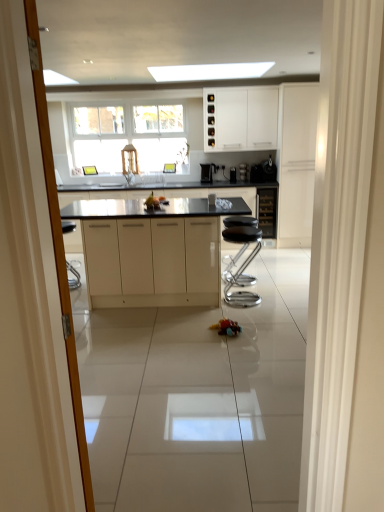
Question: Is black granite countertop at center taller than satin black coffee maker at center, the second appliance from the right?

Choices:
 (A) no
 (B) yes

Answer: (B)

Question: Is black granite countertop at center oriented towards satin black coffee maker at center, the second appliance from the right?

Choices:
 (A) no
 (B) yes

Answer: (A)

Question: Is black granite countertop at center smaller than satin black coffee maker at center, the second appliance from the right?

Choices:
 (A) no
 (B) yes

Answer: (A)

Question: Is black granite countertop at center positioned far away from satin black coffee maker at center, the second appliance from the right?

Choices:
 (A) no
 (B) yes

Answer: (B)

Question: Is black granite countertop at center completely or partially outside of satin black coffee maker at center, the second appliance from the right?

Choices:
 (A) yes
 (B) no

Answer: (A)

Question: Does black granite countertop at center have a larger size compared to satin black coffee maker at center, placed as the second appliance when sorted from left to right?

Choices:
 (A) yes
 (B) no

Answer: (A)

Question: Is black granite countertop at center turned away from satin black coffee machine at upper right, the third appliance positioned from the left?

Choices:
 (A) yes
 (B) no

Answer: (B)

Question: From a real-world perspective, is black granite countertop at center on top of satin black coffee machine at upper right, which appears as the 1th appliance when viewed from the right?

Choices:
 (A) yes
 (B) no

Answer: (B)

Question: From the image's perspective, is black granite countertop at center above satin black coffee machine at upper right, the third appliance positioned from the left?

Choices:
 (A) yes
 (B) no

Answer: (B)

Question: Is black granite countertop at center closer to the viewer compared to satin black coffee machine at upper right, the third appliance positioned from the left?

Choices:
 (A) no
 (B) yes

Answer: (A)

Question: Is black granite countertop at center completely or partially outside of satin black coffee machine at upper right, which appears as the 1th appliance when viewed from the right?

Choices:
 (A) no
 (B) yes

Answer: (B)

Question: Is black granite countertop at center wider than satin black coffee machine at upper right, which appears as the 1th appliance when viewed from the right?

Choices:
 (A) no
 (B) yes

Answer: (B)

Question: Is black granite countertop at center smaller than matte black cabinet at center, positioned as the 2th cabinetry in right-to-left order?

Choices:
 (A) no
 (B) yes

Answer: (A)